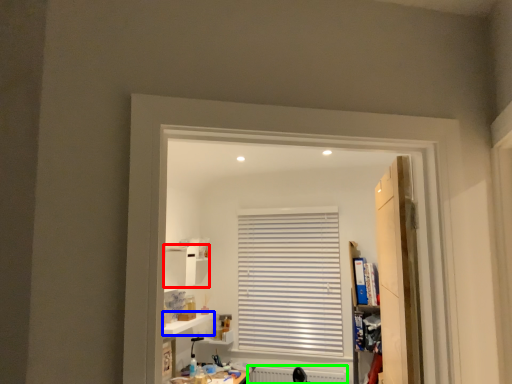
Question: Which object is the farthest from cabinet (highlighted by a red box)? Choose among these: window sill (highlighted by a blue box) or radiator (highlighted by a green box).

Choices:
 (A) window sill
 (B) radiator

Answer: (B)